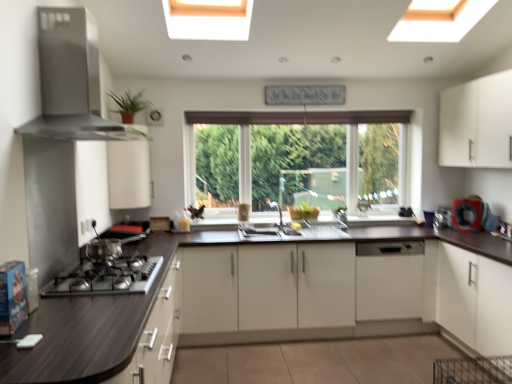
Question: Is white matte cabinet at upper right, acting as the fourth cabinetry starting from the left, shorter than white glossy sink at center?

Choices:
 (A) yes
 (B) no

Answer: (B)

Question: Is white glossy sink at center at the back of white matte cabinet at upper right, arranged as the first cabinetry when viewed from the right?

Choices:
 (A) no
 (B) yes

Answer: (A)

Question: From the image's perspective, is white matte cabinet at upper right, arranged as the first cabinetry when viewed from the right, over white glossy sink at center?

Choices:
 (A) yes
 (B) no

Answer: (A)

Question: Can you confirm if white matte cabinet at upper right, arranged as the first cabinetry when viewed from the right, is wider than white glossy sink at center?

Choices:
 (A) yes
 (B) no

Answer: (B)

Question: Is white matte cabinet at upper right, acting as the fourth cabinetry starting from the left, thinner than white glossy sink at center?

Choices:
 (A) no
 (B) yes

Answer: (B)

Question: Considering the relative positions of white matte cabinet at upper right, acting as the fourth cabinetry starting from the left, and white glossy sink at center in the image provided, is white matte cabinet at upper right, acting as the fourth cabinetry starting from the left, to the right of white glossy sink at center from the viewer's perspective?

Choices:
 (A) yes
 (B) no

Answer: (A)

Question: From a real-world perspective, is green matte plant at upper left on satin nickel faucet at center?

Choices:
 (A) yes
 (B) no

Answer: (A)

Question: Can you confirm if green matte plant at upper left is thinner than satin nickel faucet at center?

Choices:
 (A) no
 (B) yes

Answer: (B)

Question: Considering the relative sizes of green matte plant at upper left and satin nickel faucet at center in the image provided, is green matte plant at upper left shorter than satin nickel faucet at center?

Choices:
 (A) yes
 (B) no

Answer: (A)

Question: Considering the relative sizes of green matte plant at upper left and satin nickel faucet at center in the image provided, is green matte plant at upper left smaller than satin nickel faucet at center?

Choices:
 (A) yes
 (B) no

Answer: (B)

Question: Is green matte plant at upper left facing towards satin nickel faucet at center?

Choices:
 (A) yes
 (B) no

Answer: (B)

Question: From a real-world perspective, is green matte plant at upper left located beneath satin nickel faucet at center?

Choices:
 (A) no
 (B) yes

Answer: (A)

Question: Is dark wood countertop at lower left oriented towards stainless steel range hood at upper left?

Choices:
 (A) no
 (B) yes

Answer: (A)